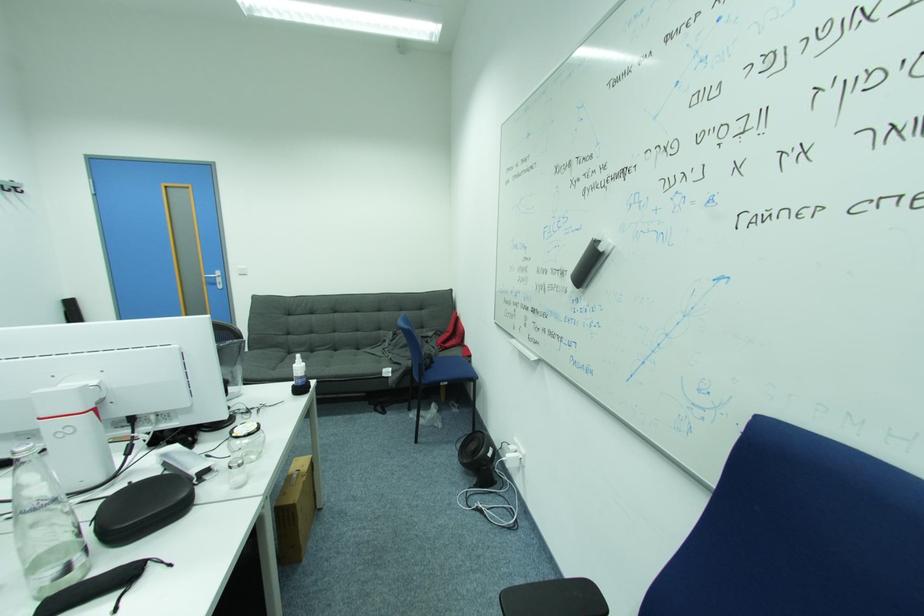
Identify the location of black zippered case. The width and height of the screenshot is (924, 616). (142, 508).